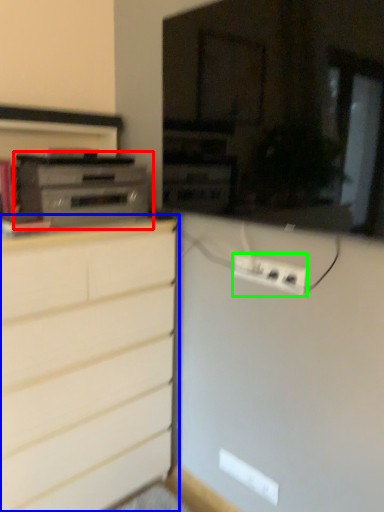
Question: Estimate the real-world distances between objects in this image. Which object is farther from home appliance (highlighted by a red box), chest of drawers (highlighted by a blue box) or electric outlet (highlighted by a green box)?

Choices:
 (A) chest of drawers
 (B) electric outlet

Answer: (B)